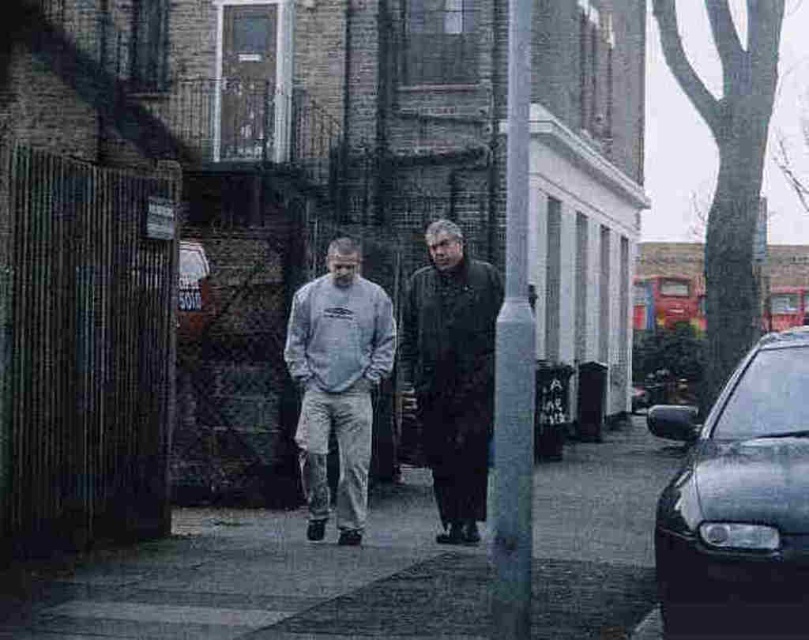
Is shiny black car at right smaller than smooth gray pole at center?

No.

Which is behind, point (680, 605) or point (524, 42)?

The point (524, 42) is more distant.

Locate an element on the screen. shiny black car at right is located at coordinates (738, 500).

Can you confirm if dark brown leather coat at center is positioned to the right of smooth gray pole at center?

No, dark brown leather coat at center is not to the right of smooth gray pole at center.

Which is more to the right, dark brown leather coat at center or smooth gray pole at center?

smooth gray pole at center is more to the right.

The image size is (809, 640). What do you see at coordinates (452, 374) in the screenshot? I see `dark brown leather coat at center` at bounding box center [452, 374].

I want to click on dark brown leather coat at center, so click(x=452, y=374).

Does gray concrete pavement at center have a larger size compared to gray cotton sweatshirt at center?

Indeed, gray concrete pavement at center has a larger size compared to gray cotton sweatshirt at center.

Between gray concrete pavement at center and gray cotton sweatshirt at center, which one has more height?

gray cotton sweatshirt at center is taller.

Image resolution: width=809 pixels, height=640 pixels. In order to click on gray concrete pavement at center in this screenshot , I will do `click(273, 584)`.